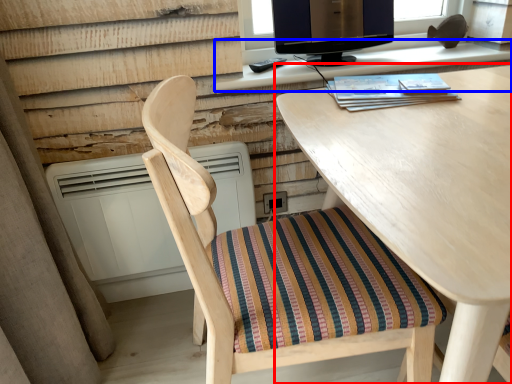
Question: Which of the following is the farthest to the observer, desk (highlighted by a red box) or computer desk (highlighted by a blue box)?

Choices:
 (A) desk
 (B) computer desk

Answer: (B)